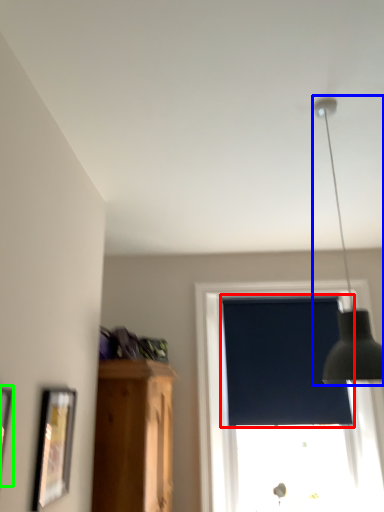
Question: Which object is positioned farthest from window screen (highlighted by a red box)? Select from lamp (highlighted by a blue box) and picture frame (highlighted by a green box).

Choices:
 (A) lamp
 (B) picture frame

Answer: (B)